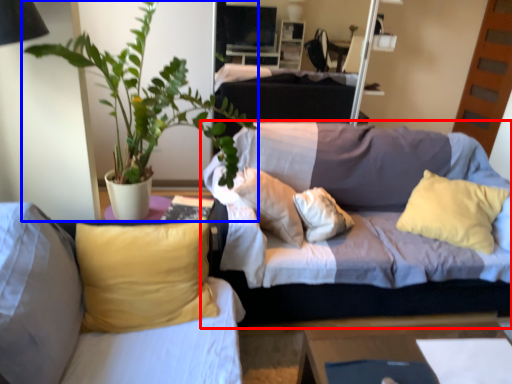
Question: Among these objects, which one is farthest to the camera, studio couch (highlighted by a red box) or houseplant (highlighted by a blue box)?

Choices:
 (A) studio couch
 (B) houseplant

Answer: (A)